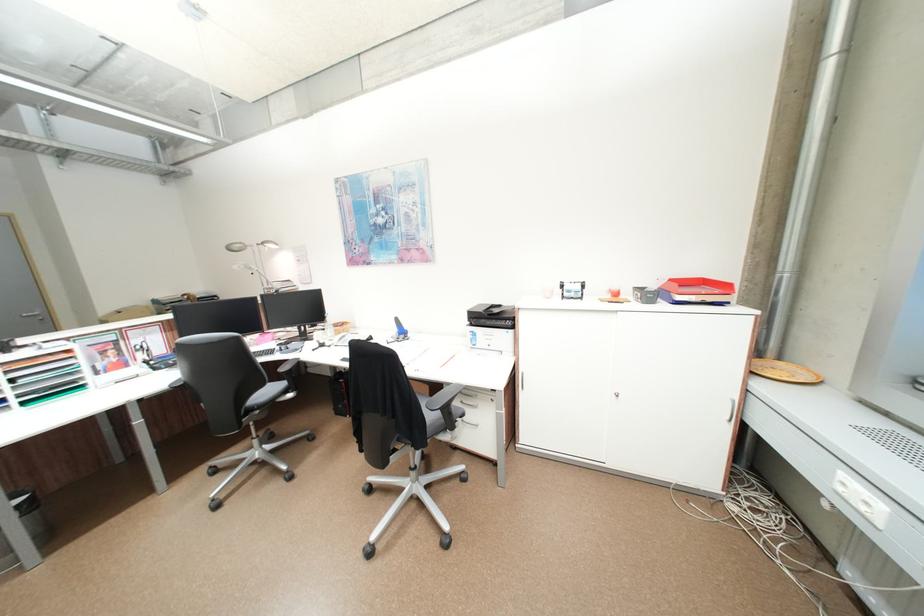
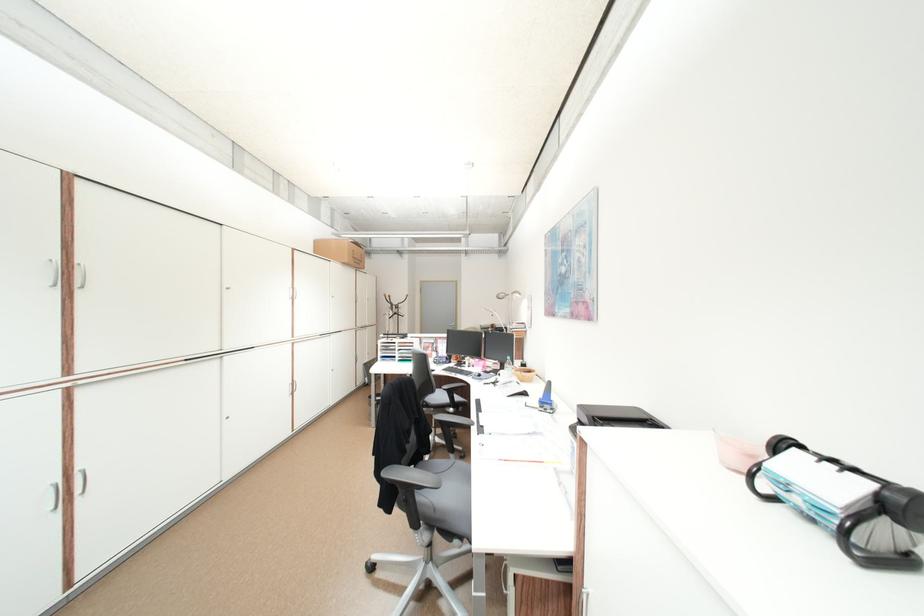
The point at (x=307, y=334) is marked in the first image. Where is the corresponding point in the second image?

(507, 368)